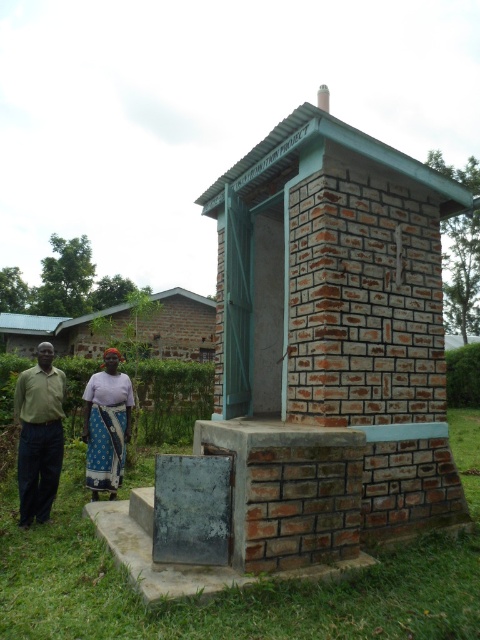
Question: Which is farther from the matte green shirt at left?

Choices:
 (A) blue patterned skirt at lower left
 (B) blue printed fabric at lower left

Answer: (B)

Question: Among these points, which one is nearest to the camera?

Choices:
 (A) (109, 349)
 (B) (93, 385)
 (C) (222, 419)

Answer: (C)

Question: Which point appears closest to the camera in this image?

Choices:
 (A) (108, 426)
 (B) (36, 472)

Answer: (B)

Question: Does brick/rough brick toilet at center appear on the left side of matte green shirt at left?

Choices:
 (A) no
 (B) yes

Answer: (A)

Question: Is brick/rough brick toilet at center closer to camera compared to blue patterned skirt at lower left?

Choices:
 (A) yes
 (B) no

Answer: (A)

Question: Is brick/rough brick toilet at center to the right of blue patterned skirt at lower left from the viewer's perspective?

Choices:
 (A) no
 (B) yes

Answer: (B)